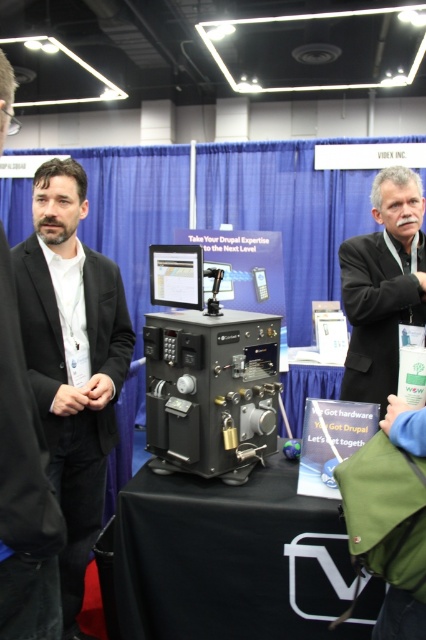
Based on the photo, you are setting up a booth at a trade show and need to place two suits next to each other on the table. The table has limited space. Which of the two suits, the black matte suit at left or the matte black suit at left, should you place first to ensure both fit on the table?

The black matte suit at left is wider than the matte black suit at left. To ensure both fit on the table, place the wider black matte suit at left first, then the narrower matte black suit at left next to it.